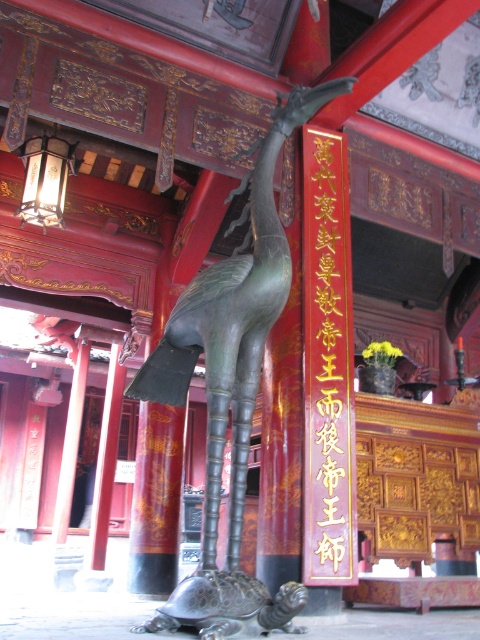
Question: Is bronze statue at center closer to the viewer compared to red wood sign at center?

Choices:
 (A) no
 (B) yes

Answer: (B)

Question: Which point is closer to the camera taking this photo?

Choices:
 (A) (314, 504)
 (B) (212, 572)

Answer: (B)

Question: Is bronze statue at center wider than red wood sign at center?

Choices:
 (A) yes
 (B) no

Answer: (A)

Question: Among these objects, which one is nearest to the camera?

Choices:
 (A) bronze statue at center
 (B) red wood sign at center

Answer: (A)

Question: Is bronze statue at center positioned before red wood sign at center?

Choices:
 (A) no
 (B) yes

Answer: (B)

Question: Among these objects, which one is farthest from the camera?

Choices:
 (A) red wood sign at center
 (B) bronze statue at center

Answer: (A)